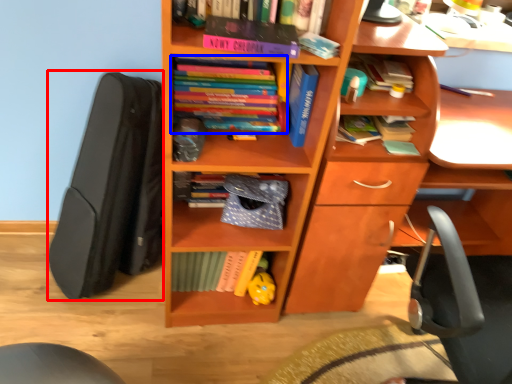
Question: Which of the following is the closest to the observer, open (highlighted by a red box) or book (highlighted by a blue box)?

Choices:
 (A) open
 (B) book

Answer: (A)